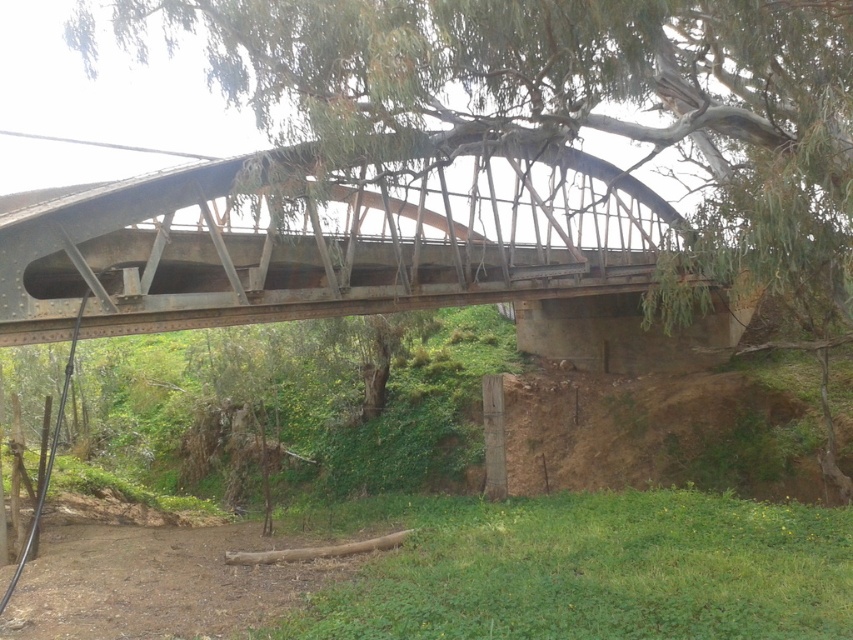
You are a hiker who wants to cross the rusty metal bridge at center. There is a green leafy tree at center directly below the bridge. Is there enough space between the bridge and the tree for you to walk under the bridge without touching the tree?

The green leafy tree at center is located below the rusty metal bridge at center, so there is no space between them. You cannot walk under the bridge without touching the tree.

You are standing at the point marked by the coordinate point (x=581, y=115) on the bridge. Looking around, you see a green leafy tree at center. Which direction should you face to see the green leafy tree at center?

Since the point (x=581, y=115) marks the green leafy tree at center, you are already at the location of the tree. Therefore, you don not need to face any particular direction to see it as you are already at its location.

You are standing on the rusty metal bridge at center and want to reach the green leafy tree at center. Which direction should you walk to get closer to the tree?

The green leafy tree at center is positioned on the right side of the rusty metal bridge at center, so you should walk to the right to get closer to the tree.